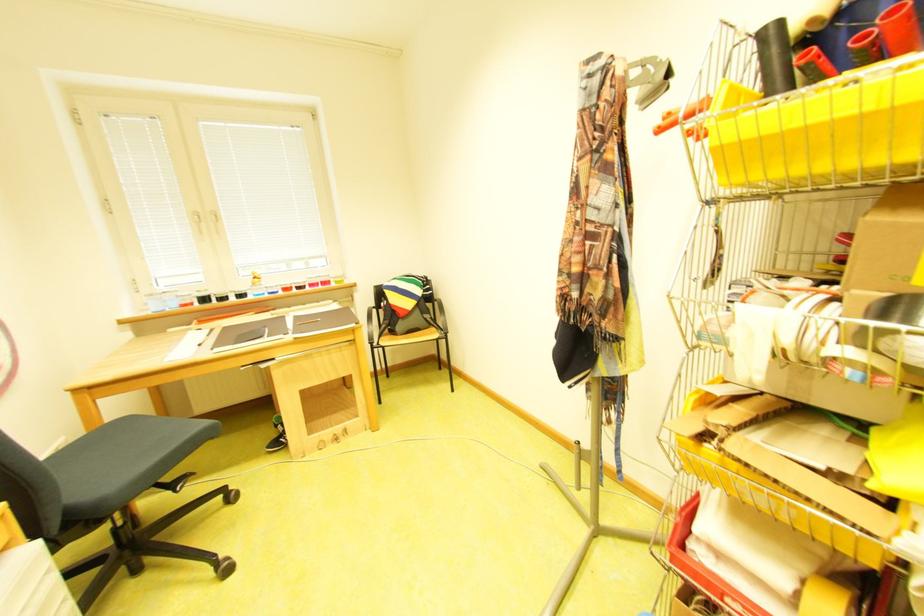
The height and width of the screenshot is (616, 924). Describe the element at coordinates (110, 464) in the screenshot. I see `a black chair sitting surface` at that location.